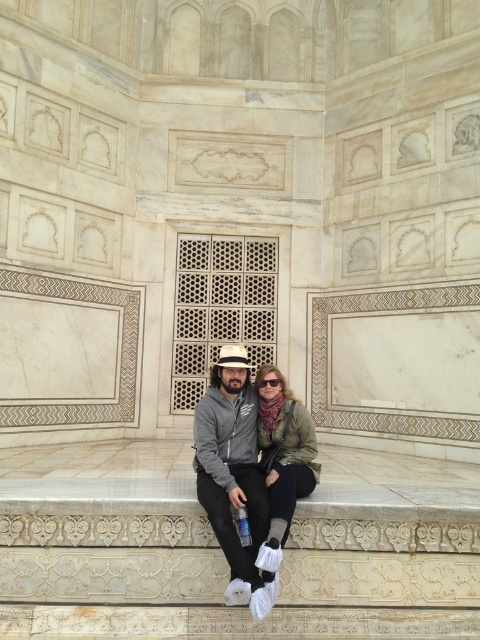
You are standing in front of the historical structure and see the point at coordinates [237,476]. What object is located at that point?

The matte gray hoodie at center is located at point [237,476].

You are planning to sit between the matte gray hoodie at center and the green textured jacket at center on the stone bench. Considering their sizes, which side should you choose to sit on to have more space?

You should sit next to the green textured jacket at center because the matte gray hoodie at center is wider, so the side with the green textured jacket at center will have more available space.

You are a tour guide explaining the seating arrangement in the historical structure. Which of the two people, the matte gray hoodie at center or the green textured jacket at center, is sitting closer to the lattice window mentioned in the scene description?

The matte gray hoodie at center is positioned under the green textured jacket at center, meaning the matte gray hoodie at center is sitting closer to the lattice window since it is lower in position.